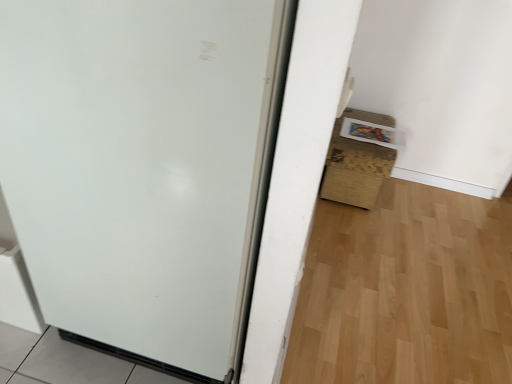
Locate an element on the screen. vacant space situated above brown cardboard box at lower right (from a real-world perspective) is located at coordinates (362, 124).